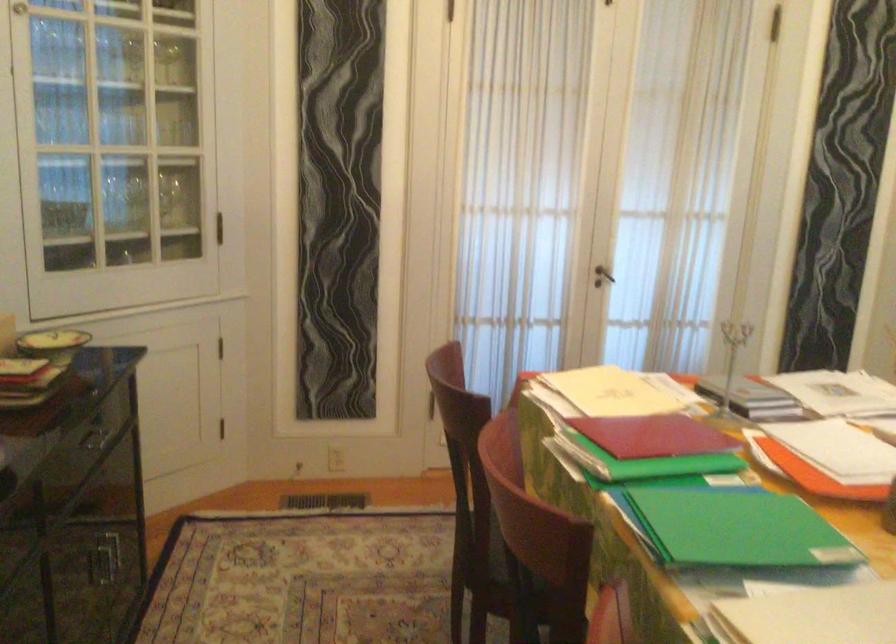
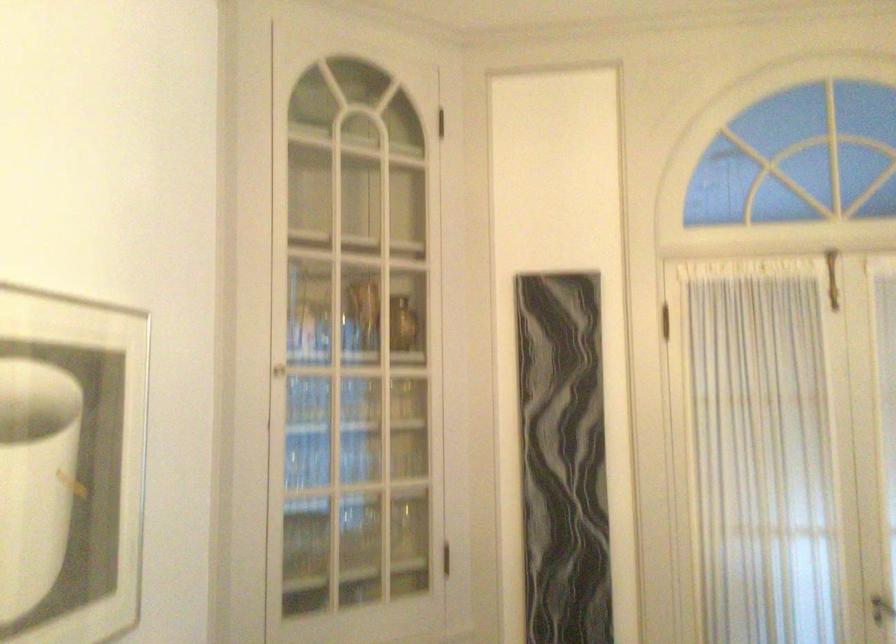
Find the pixel in the second image that matches [600,281] in the first image.

(882, 609)